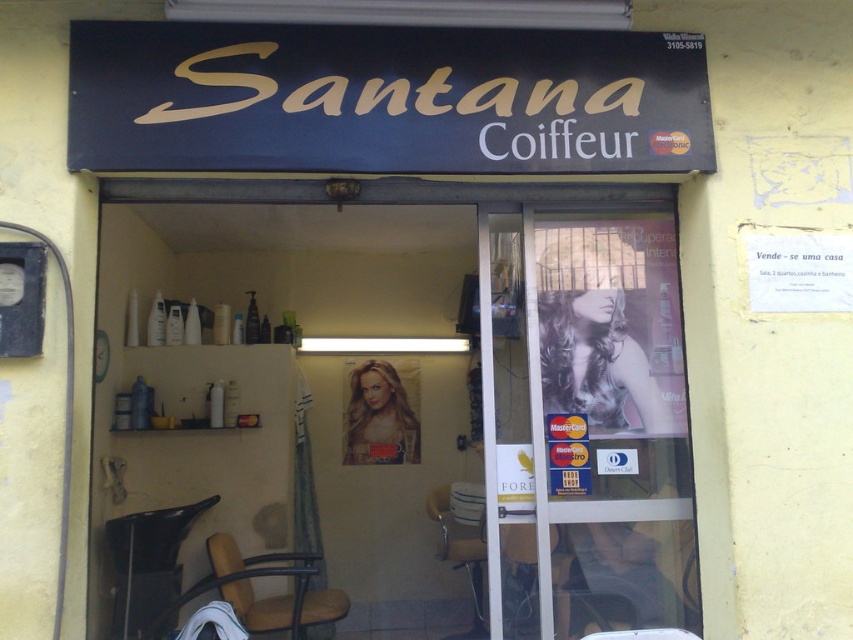
You are a customer standing outside the Santana Coiffeur salon. You see the matte gold sign at upper center and the brown leather chair at lower center. Which object is taller?

The matte gold sign at upper center is taller than the brown leather chair at lower center.

Looking at this image, you are a customer entering Santana Coiffeur and want to sit in the black plastic chair at lower left. After entering, which side of the matte gold sign at upper center will the chair be on?

The black plastic chair at lower left is on the left side of the matte gold sign at upper center.

You are a customer standing outside the Santana Coiffeur salon and want to enter. You notice the matte gold sign at upper center and the metallic gold chair at center. Which object is closer to you as you look at the entrance?

The matte gold sign at upper center is closer to the viewer than the metallic gold chair at center.